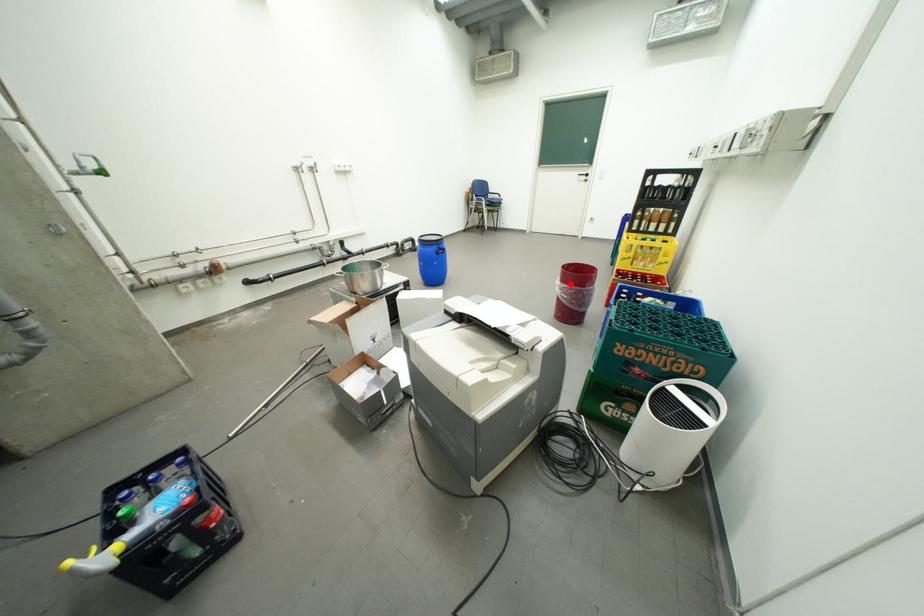
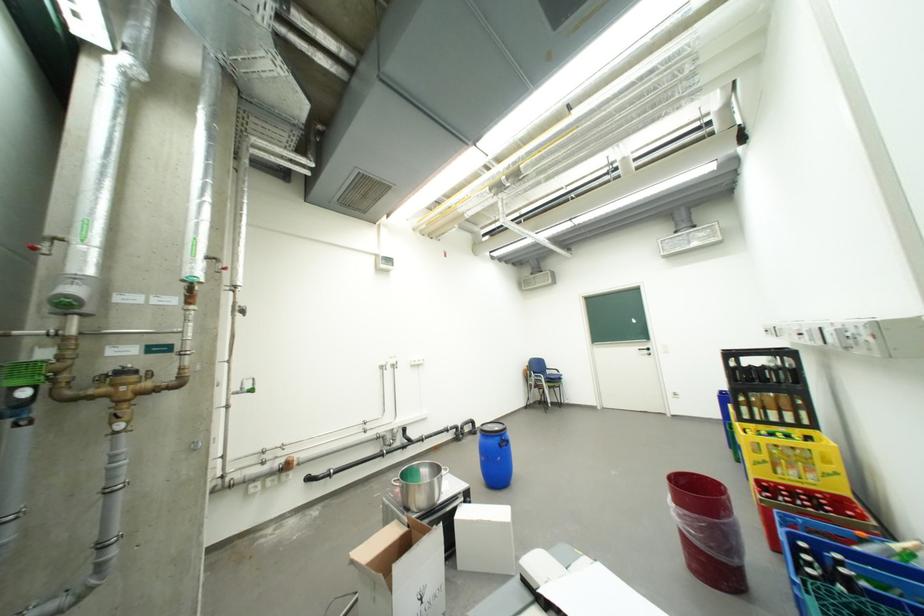
Question: I am providing you with two images of the same scene from different viewpoints. Given a red point in image1, look at the same physical point in image2. Is it:

Choices:
 (A) Closer to the viewpoint
 (B) Farther from the viewpoint

Answer: (B)